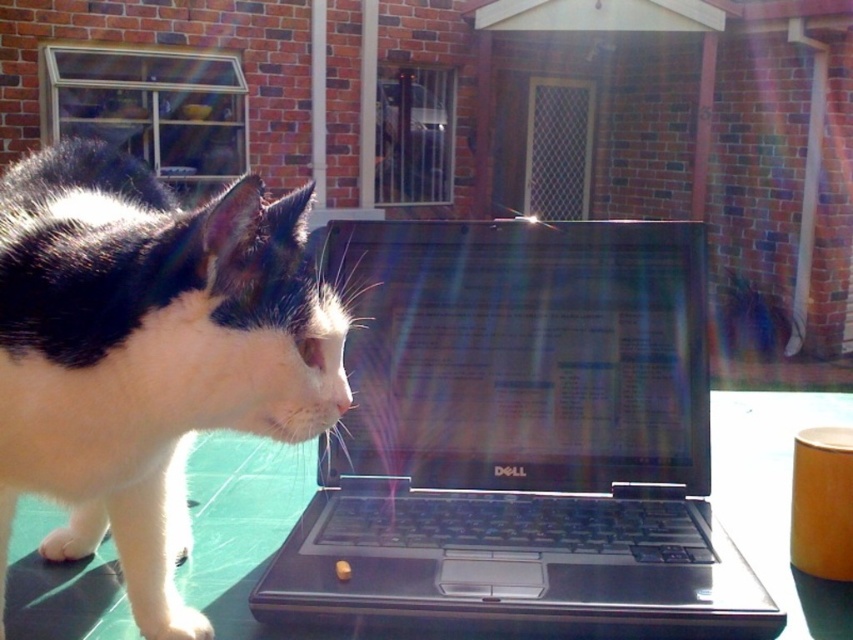
Imagine you are standing at the center of the image and looking towards the cat. Which of the two points, point (20, 326) or point (750, 504), is closer to you?

Point (20, 326) is in front of point (750, 504), so it is closer to you.

You are a photographer trying to capture a clear photo of the black plastic laptop at center without the black and white fur cat at left appearing in the frame. Based on their positions, is this possible?

The black and white fur cat at left is behind the black plastic laptop at center, so it is possible to take a photo of the black plastic laptop at center without the cat appearing in the frame by focusing on the front of the laptop where the cat is not obstructing the view.

You are trying to place a small plant pot between the black plastic laptop at center and the green glossy table at center. Based on their positions, which object should the plant pot be closer to?

The black plastic laptop at center is to the left of green glossy table at center, so the plant pot should be placed closer to the green glossy table at center to be between them.